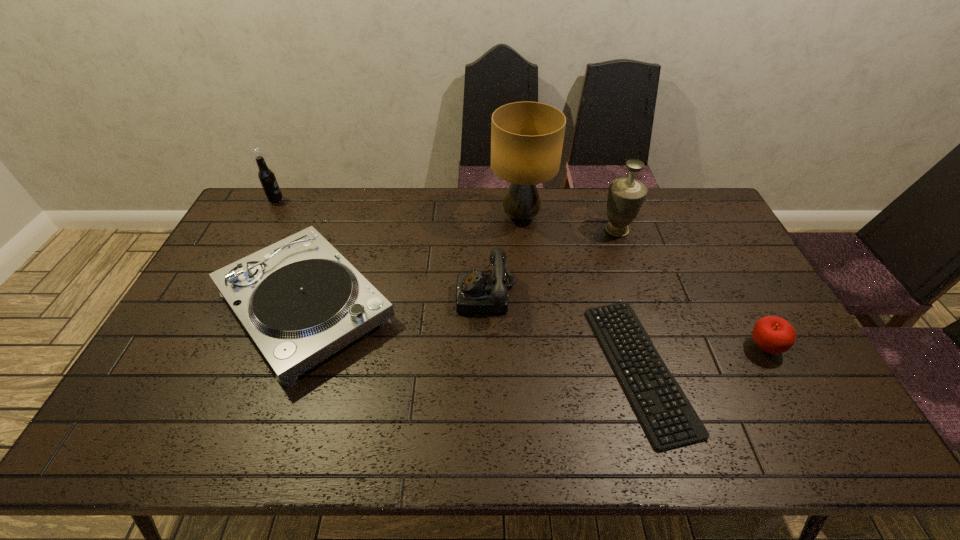
In order to click on vacant space located 0.280m on the dial of the telephone in this screenshot , I will do `click(364, 295)`.

At what (x,y) coordinates should I click in order to perform the action: click on free region located 0.070m on the dial of the telephone. Please return your answer as a coordinate pair (x, y). Looking at the image, I should click on (434, 295).

Find the location of a particular element. The image size is (960, 540). free space located on the dial of the telephone is located at coordinates (427, 295).

What are the coordinates of `vacant space positioned 0.140m on the right of the record player` in the screenshot? It's located at (446, 306).

The width and height of the screenshot is (960, 540). I want to click on free space located 0.170m on the back of the rightmost object, so click(732, 288).

Locate an element on the screen. This screenshot has width=960, height=540. vacant region located on the right of the shortest object is located at coordinates (797, 368).

Where is `lampshade that is positioned at the far edge`? lampshade that is positioned at the far edge is located at coordinates (527, 138).

Where is `urn at the far edge`? The width and height of the screenshot is (960, 540). urn at the far edge is located at coordinates (625, 198).

You are a GUI agent. You are given a task and a screenshot of the screen. Output one action in this format:
    pyautogui.click(x=<x>, y=<y>)
    Task: Click on the root beer that is at the far edge
    The image size is (960, 540).
    Given the screenshot: What is the action you would take?
    pyautogui.click(x=266, y=176)

Find the location of a particular element. The height and width of the screenshot is (540, 960). object located at the near edge is located at coordinates (668, 418).